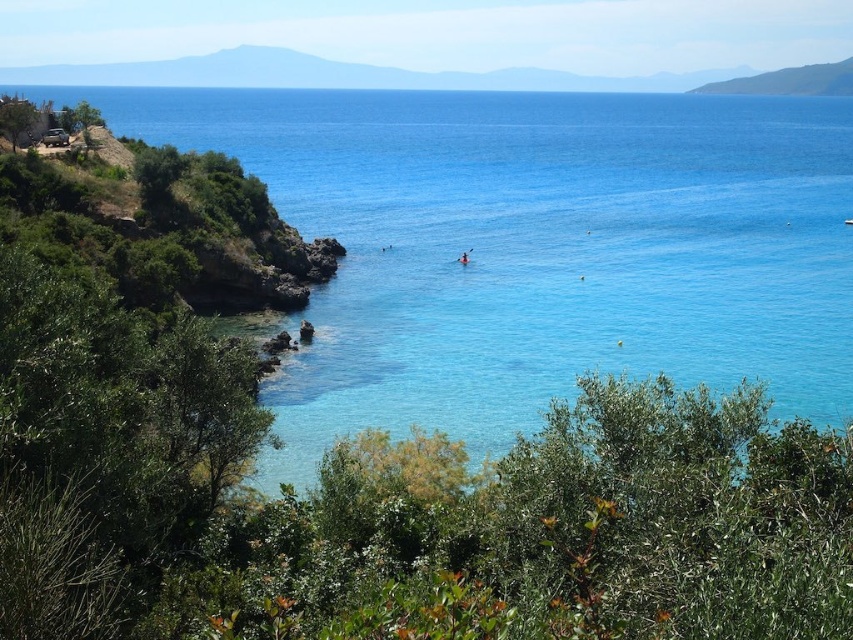
Question: Among these points, which one is nearest to the camera?

Choices:
 (A) (647, 280)
 (B) (460, 256)

Answer: (A)

Question: Which point is closer to the camera?

Choices:
 (A) (799, 220)
 (B) (467, 253)

Answer: (B)

Question: Among these objects, which one is farthest from the camera?

Choices:
 (A) orange kayak at center
 (B) clear blue water at center

Answer: (A)

Question: Does clear blue water at center appear under orange kayak at center?

Choices:
 (A) yes
 (B) no

Answer: (B)

Question: Is clear blue water at center thinner than orange kayak at center?

Choices:
 (A) yes
 (B) no

Answer: (B)

Question: Does clear blue water at center appear under orange kayak at center?

Choices:
 (A) yes
 (B) no

Answer: (B)